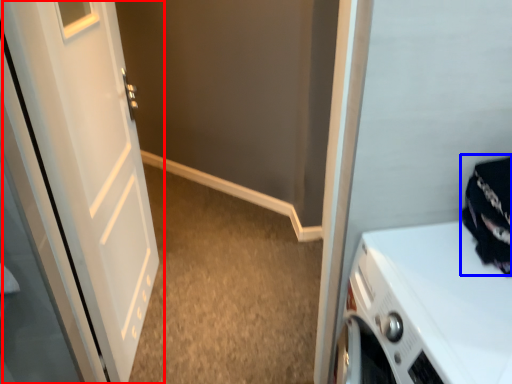
Question: Which point is further to the camera, door (highlighted by a red box) or clothing (highlighted by a blue box)?

Choices:
 (A) door
 (B) clothing

Answer: (A)